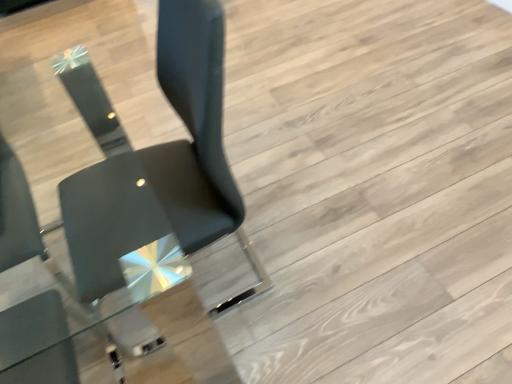
At what (x,y) coordinates should I click in order to perform the action: click on vacant area that lies to the right of matte black chair at center, the 1th chair when ordered from right to left. Please return your answer as a coordinate pair (x, y). Looking at the image, I should click on (x=313, y=246).